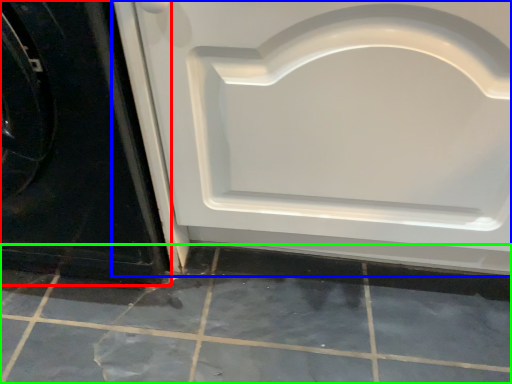
Question: Based on their relative distances, which object is farther from door (highlighted by a red box)? Choose from door (highlighted by a blue box) and ceramic tile (highlighted by a green box).

Choices:
 (A) door
 (B) ceramic tile

Answer: (B)